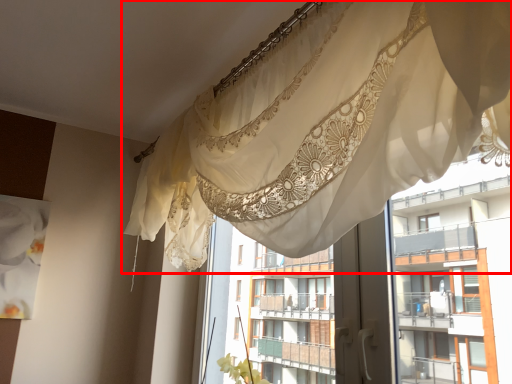
Question: Where is curtain (annotated by the red box) located in relation to residence in the image?

Choices:
 (A) left
 (B) right

Answer: (A)